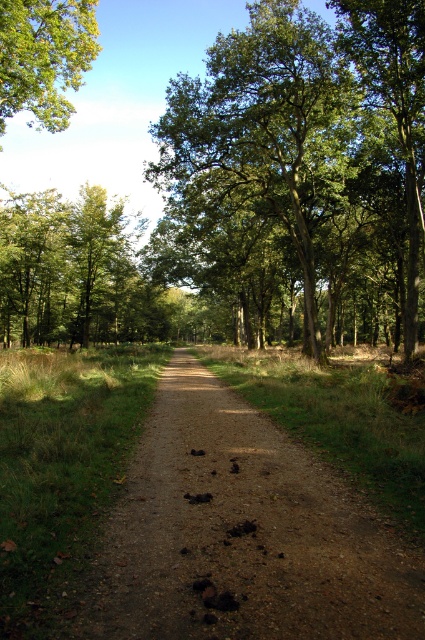
Does brown gravel path at center appear on the left side of green leafy tree at center?

Correct, you'll find brown gravel path at center to the left of green leafy tree at center.

Can you confirm if brown gravel path at center is smaller than green leafy tree at center?

Yes.

What do you see at coordinates (241, 532) in the screenshot? I see `brown gravel path at center` at bounding box center [241, 532].

What are the coordinates of `brown gravel path at center` in the screenshot? It's located at (241, 532).

Who is shorter, green leafy tree at center or green leafy tree at upper left?

green leafy tree at center is shorter.

Does green leafy tree at center have a larger size compared to green leafy tree at upper left?

Actually, green leafy tree at center might be smaller than green leafy tree at upper left.

Image resolution: width=425 pixels, height=640 pixels. Find the location of `green leafy tree at center`. green leafy tree at center is located at coordinates (258, 144).

Locate an element on the screen. green leafy tree at center is located at coordinates tap(258, 144).

Is brown gravel path at center above green leafy tree at upper left?

Incorrect, brown gravel path at center is not positioned above green leafy tree at upper left.

Which is more to the left, brown gravel path at center or green leafy tree at upper left?

Positioned to the left is green leafy tree at upper left.

You are a GUI agent. You are given a task and a screenshot of the screen. Output one action in this format:
    pyautogui.click(x=<x>, y=<y>)
    Task: Click on the brown gravel path at center
    The width and height of the screenshot is (425, 640).
    Given the screenshot: What is the action you would take?
    pyautogui.click(x=241, y=532)